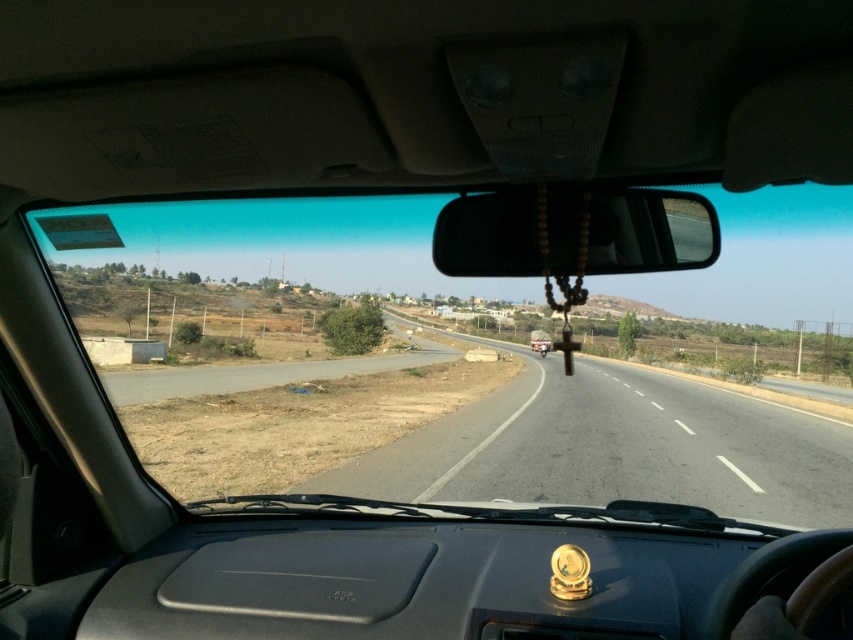
You are driving a car and notice an object on the dashboard. Where is the wooden beads at center located in relation to the car?

The wooden beads at center is located at the center of the dashboard, which is at point coordinates of (x=573, y=232).

You are sitting in the driver seat of the car and want to check the distance between two points on the road ahead. The points are labeled as point 1 at coordinates point [496,227] and point 2 at coordinates point [544,355]. Which point is closer to your current position?

Point [496,227] is closer to the camera than point [544,355], so the point closer to your current position is point [496,227].